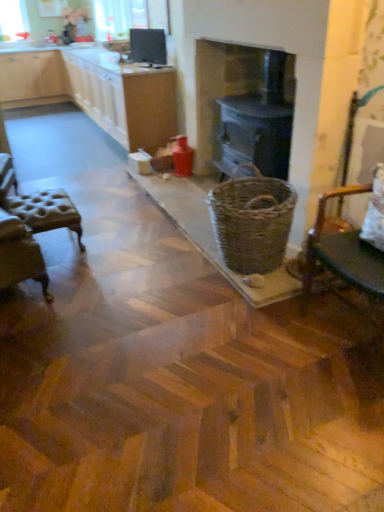
Question: Would you say matte black monitor at upper center is outside wooden chair at right, which appears as the second chair when viewed from the back?

Choices:
 (A) yes
 (B) no

Answer: (A)

Question: Considering the relative sizes of matte black monitor at upper center and wooden chair at right, which appears as the second chair when viewed from the back, in the image provided, is matte black monitor at upper center thinner than wooden chair at right, which appears as the second chair when viewed from the back,?

Choices:
 (A) no
 (B) yes

Answer: (B)

Question: From the image's perspective, is matte black monitor at upper center on top of wooden chair at right, the first chair when ordered from right to left?

Choices:
 (A) yes
 (B) no

Answer: (A)

Question: From the image's perspective, is matte black monitor at upper center located beneath wooden chair at right, the first chair when ordered from right to left?

Choices:
 (A) yes
 (B) no

Answer: (B)

Question: Is matte black monitor at upper center at the right side of wooden chair at right, the first chair when ordered from right to left?

Choices:
 (A) yes
 (B) no

Answer: (B)

Question: Considering their positions, is transparent plastic window screen at upper left located in front of or behind light wood cabinetry at upper left, the 1th cabinetry viewed from the back?

Choices:
 (A) behind
 (B) front

Answer: (A)

Question: In terms of height, does transparent plastic window screen at upper left look taller or shorter compared to light wood cabinetry at upper left, placed as the second cabinetry when sorted from front to back?

Choices:
 (A) tall
 (B) short

Answer: (B)

Question: Is point (8, 12) closer or farther from the camera than point (64, 73)?

Choices:
 (A) farther
 (B) closer

Answer: (B)

Question: Looking at the image, does transparent plastic window screen at upper left seem bigger or smaller compared to light wood cabinetry at upper left, placed as the second cabinetry when sorted from front to back?

Choices:
 (A) small
 (B) big

Answer: (A)

Question: Is white wood cabinets at upper left, the 2th cabinetry positioned from the back, taller or shorter than light wood cabinetry at upper left, placed as the second cabinetry when sorted from front to back?

Choices:
 (A) short
 (B) tall

Answer: (A)

Question: Do you think white wood cabinets at upper left, the 2th cabinetry positioned from the back, is within light wood cabinetry at upper left, the 1th cabinetry viewed from the back, or outside of it?

Choices:
 (A) inside
 (B) outside

Answer: (B)

Question: From a real-world perspective, relative to light wood cabinetry at upper left, the 1th cabinetry viewed from the back, is white wood cabinets at upper left, the 2th cabinetry positioned from the back, vertically above or below?

Choices:
 (A) above
 (B) below

Answer: (A)

Question: Considering the positions of white wood cabinets at upper left, which appears as the 1th cabinetry when viewed from the front, and light wood cabinetry at upper left, the 1th cabinetry viewed from the back, in the image, is white wood cabinets at upper left, which appears as the 1th cabinetry when viewed from the front, bigger or smaller than light wood cabinetry at upper left, the 1th cabinetry viewed from the back,?

Choices:
 (A) big
 (B) small

Answer: (A)

Question: Is tufted leather stool at left, which ranks as the 1th chair in left-to-right order, spatially inside white wood cabinets at upper left, the 2th cabinetry positioned from the back, or outside of it?

Choices:
 (A) inside
 (B) outside

Answer: (B)

Question: Considering the relative positions of tufted leather stool at left, placed as the second chair when sorted from front to back, and white wood cabinets at upper left, which appears as the 1th cabinetry when viewed from the front, in the image provided, is tufted leather stool at left, placed as the second chair when sorted from front to back, to the left or to the right of white wood cabinets at upper left, which appears as the 1th cabinetry when viewed from the front,?

Choices:
 (A) right
 (B) left

Answer: (A)